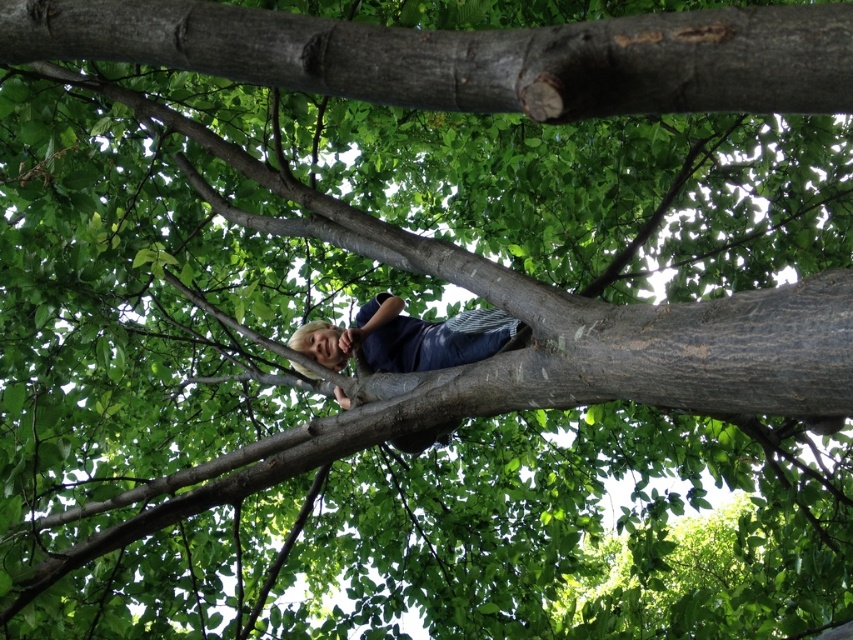
Question: Among these points, which one is nearest to the camera?

Choices:
 (A) (788, 83)
 (B) (424, 444)

Answer: (A)

Question: Does smooth gray tree trunk at upper center have a smaller size compared to blonde hair at center?

Choices:
 (A) yes
 (B) no

Answer: (A)

Question: Which object appears farthest from the camera in this image?

Choices:
 (A) smooth gray tree trunk at upper center
 (B) blonde hair at center

Answer: (B)

Question: Does smooth gray tree trunk at upper center have a greater width compared to blonde hair at center?

Choices:
 (A) yes
 (B) no

Answer: (A)

Question: Does smooth gray tree trunk at upper center have a lesser width compared to blonde hair at center?

Choices:
 (A) no
 (B) yes

Answer: (A)

Question: Which object is farther from the camera taking this photo?

Choices:
 (A) blonde hair at center
 (B) smooth gray tree trunk at upper center

Answer: (A)